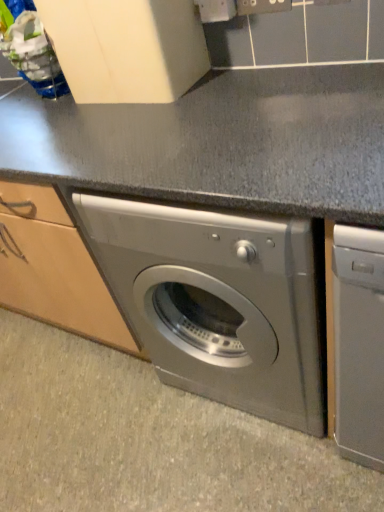
Question: Can you confirm if slate gray granite at center is bigger than satin silver washing machine at center?

Choices:
 (A) yes
 (B) no

Answer: (B)

Question: Is slate gray granite at center thinner than satin silver washing machine at center?

Choices:
 (A) no
 (B) yes

Answer: (A)

Question: Can you confirm if slate gray granite at center is smaller than satin silver washing machine at center?

Choices:
 (A) yes
 (B) no

Answer: (A)

Question: Would you say satin silver washing machine at center is part of slate gray granite at center's contents?

Choices:
 (A) yes
 (B) no

Answer: (B)

Question: Can you confirm if slate gray granite at center is shorter than satin silver washing machine at center?

Choices:
 (A) yes
 (B) no

Answer: (A)

Question: Is there a large distance between slate gray granite at center and satin silver washing machine at center?

Choices:
 (A) yes
 (B) no

Answer: (B)

Question: Can you confirm if satin silver washing machine at center is thinner than slate gray granite at center?

Choices:
 (A) no
 (B) yes

Answer: (B)

Question: From the image's perspective, is satin silver washing machine at center below slate gray granite at center?

Choices:
 (A) no
 (B) yes

Answer: (A)

Question: Is satin silver washing machine at center at the right side of slate gray granite at center?

Choices:
 (A) no
 (B) yes

Answer: (B)

Question: Are satin silver washing machine at center and slate gray granite at center far apart?

Choices:
 (A) no
 (B) yes

Answer: (A)

Question: Does satin silver washing machine at center have a larger size compared to slate gray granite at center?

Choices:
 (A) yes
 (B) no

Answer: (A)

Question: Is the depth of satin silver washing machine at center less than that of slate gray granite at center?

Choices:
 (A) yes
 (B) no

Answer: (A)

Question: From a real-world perspective, is satin silver washing machine at center positioned above or below slate gray granite at center?

Choices:
 (A) below
 (B) above

Answer: (B)